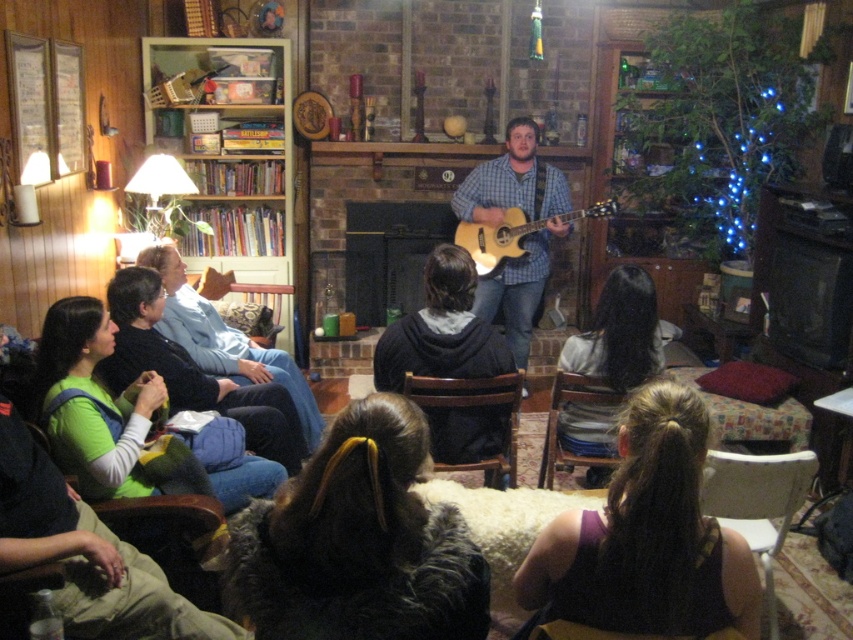
Question: Is light brown wood guitar at center to the left of brown wooden chair at center from the viewer's perspective?

Choices:
 (A) no
 (B) yes

Answer: (A)

Question: Does brown leather armchair at lower left have a lesser width compared to acoustic wood guitar at center?

Choices:
 (A) no
 (B) yes

Answer: (B)

Question: Estimate the real-world distances between objects in this image. Which object is closer to the dark brown fur at center?

Choices:
 (A) light brown wood guitar at center
 (B) black sweater at left
 (C) velvet dark brown armchair at lower center
 (D) white plastic chair at lower right

Answer: (D)

Question: Which point is farther to the camera?

Choices:
 (A) (740, 461)
 (B) (640, 278)
 (C) (405, 576)
 (D) (346, 268)

Answer: (D)

Question: From the image, what is the correct spatial relationship of brown hair at lower center in relation to velvet dark brown armchair at lower center?

Choices:
 (A) above
 (B) below

Answer: (A)

Question: Which object is positioned closest to the brown wooden chair at center?

Choices:
 (A) wooden bookshelf at upper left
 (B) black sweater at left
 (C) brown hair at lower center
 (D) light brown wood guitar at center

Answer: (B)